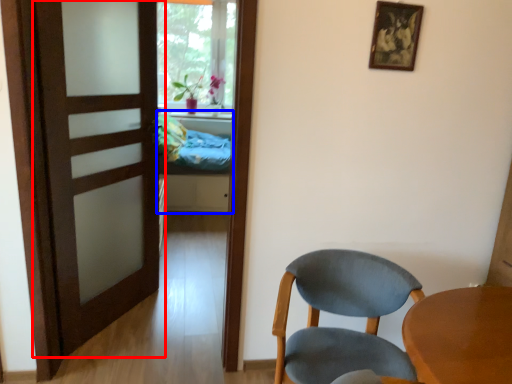
Question: Which of the following is the farthest to the observer, door (highlighted by a red box) or bed (highlighted by a blue box)?

Choices:
 (A) door
 (B) bed

Answer: (B)